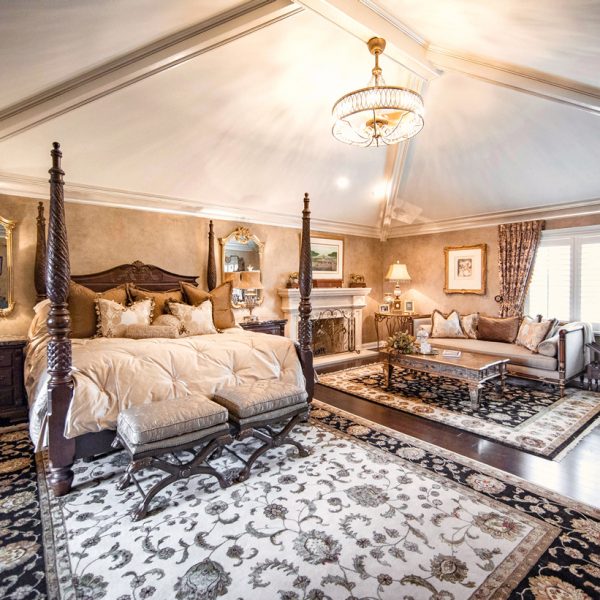
What are the coordinates of `table` in the screenshot? It's located at (471, 372).